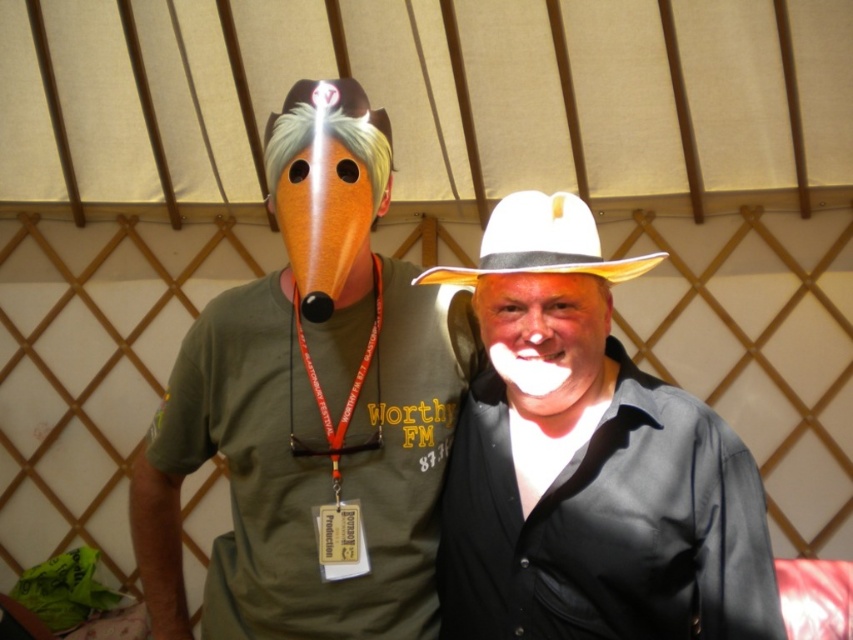
Question: Is white matte cowboy hat at center smaller than white felt cowboy hat at center?

Choices:
 (A) no
 (B) yes

Answer: (A)

Question: Is matte orange mask at center to the left of white felt cowboy hat at center from the viewer's perspective?

Choices:
 (A) no
 (B) yes

Answer: (B)

Question: Which point appears farthest from the camera in this image?

Choices:
 (A) (312, 205)
 (B) (543, 198)
 (C) (537, 429)

Answer: (C)

Question: Which point is closer to the camera?

Choices:
 (A) (154, 627)
 (B) (747, 611)
 (C) (595, 269)

Answer: (B)

Question: Which point appears closest to the camera in this image?

Choices:
 (A) (215, 556)
 (B) (479, 396)
 (C) (468, 284)

Answer: (C)

Question: Is matte orange mask at center further to camera compared to white matte cowboy hat at center?

Choices:
 (A) no
 (B) yes

Answer: (B)